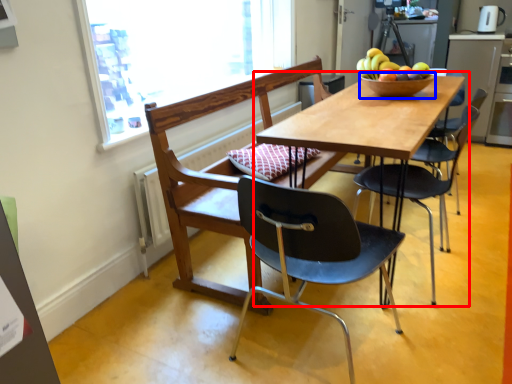
Question: Which object appears closest to the camera in this image, table (highlighted by a red box) or bowl (highlighted by a blue box)?

Choices:
 (A) table
 (B) bowl

Answer: (A)